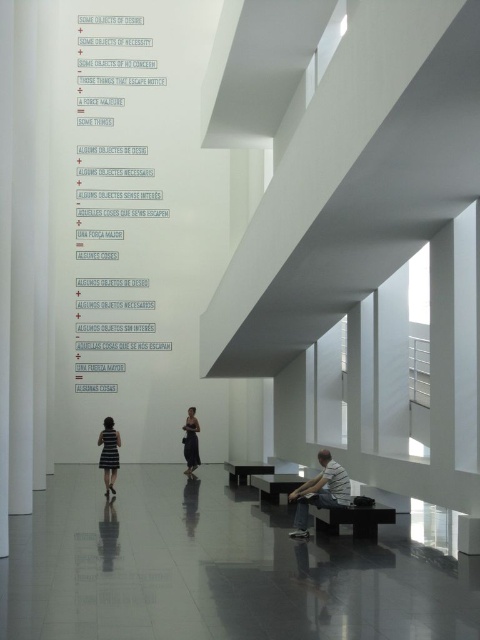
Question: Which object appears farthest from the camera in this image?

Choices:
 (A) matte black bench at center
 (B) black striped dress at center

Answer: (A)

Question: Is black striped dress at center smaller than matte black bench at lower center?

Choices:
 (A) yes
 (B) no

Answer: (A)

Question: Which object is farther from the camera taking this photo?

Choices:
 (A) matte black bench at lower center
 (B) black polished wood bench at lower right
 (C) black striped dress at center
 (D) light gray t-shirt at lower center

Answer: (C)

Question: Is the position of light gray t-shirt at lower center less distant than that of black silk dress at center?

Choices:
 (A) yes
 (B) no

Answer: (A)

Question: Among these points, which one is farthest from the camera?

Choices:
 (A) (241, 465)
 (B) (294, 524)
 (C) (374, 528)
 (D) (115, 449)

Answer: (A)

Question: Does black striped dress at center have a lesser width compared to matte black bench at lower center?

Choices:
 (A) yes
 (B) no

Answer: (A)